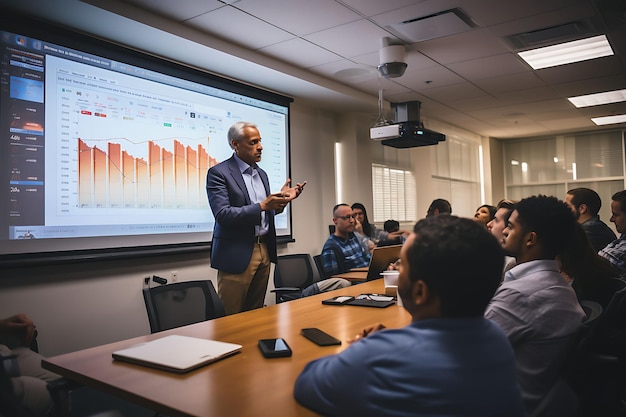
Where is `laptop computer`? laptop computer is located at coordinates (181, 358), (218, 343), (385, 259), (367, 263).